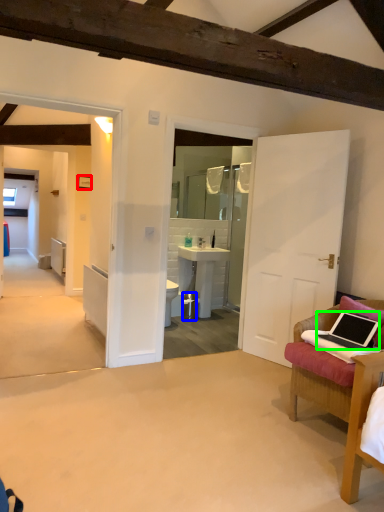
Question: Which object is positioned closest to picture frame (highlighted by a red box)? Select from trash bin/can (highlighted by a blue box) and laptop (highlighted by a green box).

Choices:
 (A) trash bin/can
 (B) laptop

Answer: (A)